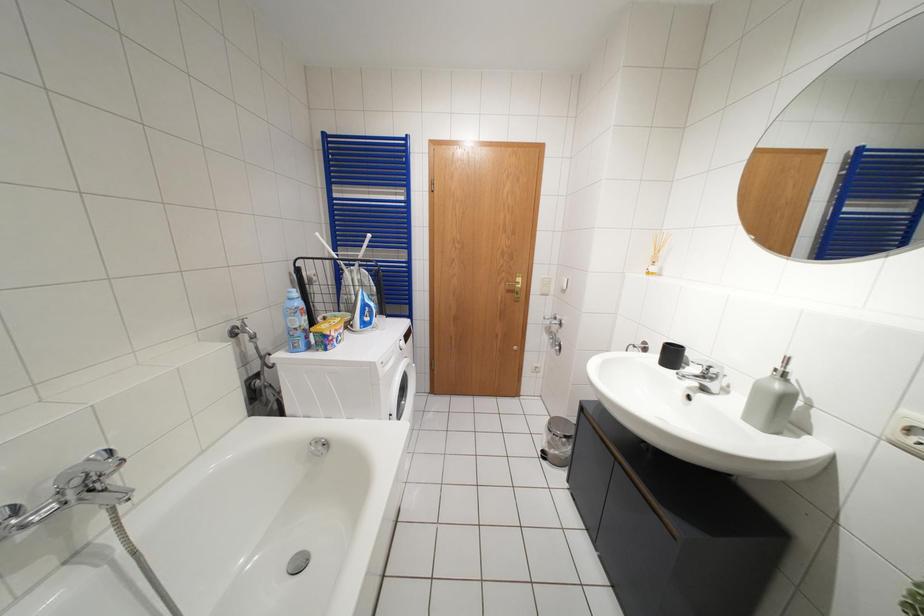
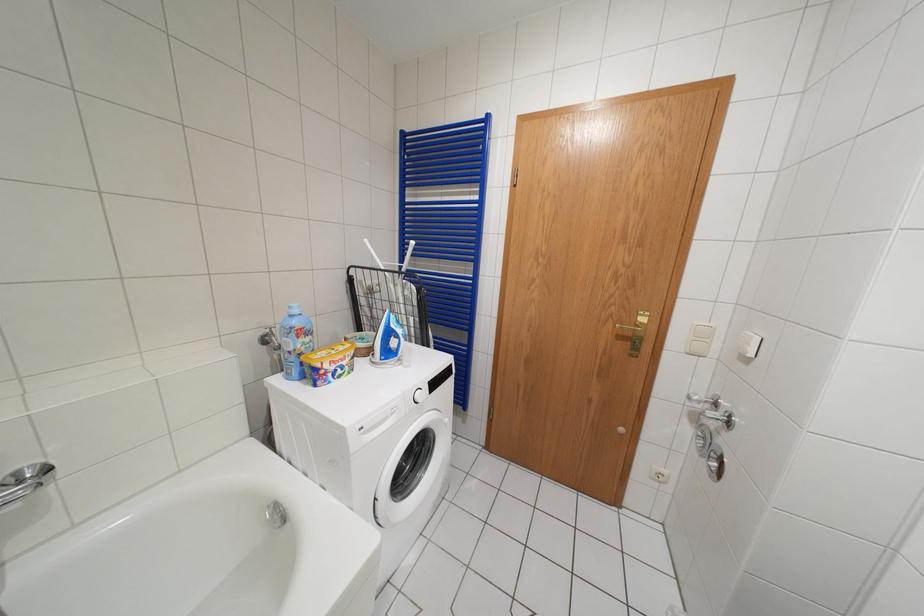
Question: The camera is either moving clockwise (left) or counter-clockwise (right) around the object. The first image is from the beginning of the video and the second image is from the end. Is the camera moving left or right when shooting the video?

Choices:
 (A) Left
 (B) Right

Answer: (B)